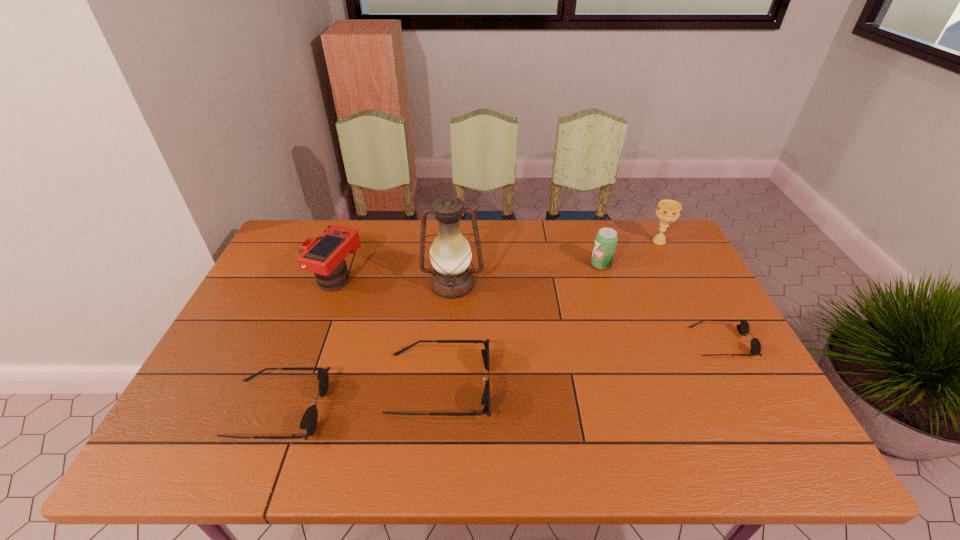
Find the location of a particular element. sunglasses that is at the right edge is located at coordinates (743, 328).

In order to click on chalice situated at the right edge in this screenshot , I will do `click(668, 211)`.

Find the location of a particular element. object at the far left corner is located at coordinates (324, 256).

This screenshot has height=540, width=960. In order to click on object that is at the near left corner in this screenshot , I will do `click(309, 420)`.

Locate an element on the screen. This screenshot has width=960, height=540. object located in the far right corner section of the desktop is located at coordinates (668, 211).

The height and width of the screenshot is (540, 960). What are the coordinates of `blank area at the far edge` in the screenshot? It's located at (420, 247).

Find the location of a particular element. free space at the left edge of the desktop is located at coordinates (261, 365).

Identify the location of free spot at the right edge of the desktop. (654, 286).

Locate an element on the screen. This screenshot has height=540, width=960. vacant space at the far left corner of the desktop is located at coordinates (293, 237).

Where is `vacant space at the far right corner of the desktop`? The image size is (960, 540). vacant space at the far right corner of the desktop is located at coordinates 622,221.